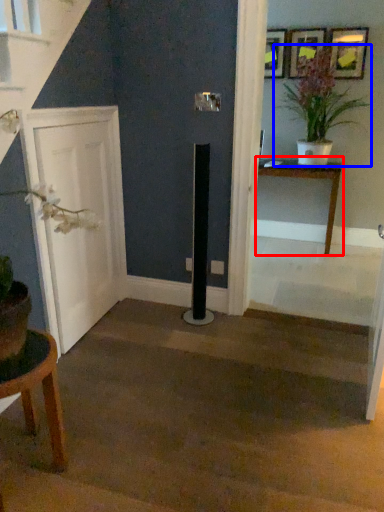
Question: Which object is closer to the camera taking this photo, table (highlighted by a red box) or houseplant (highlighted by a blue box)?

Choices:
 (A) table
 (B) houseplant

Answer: (B)